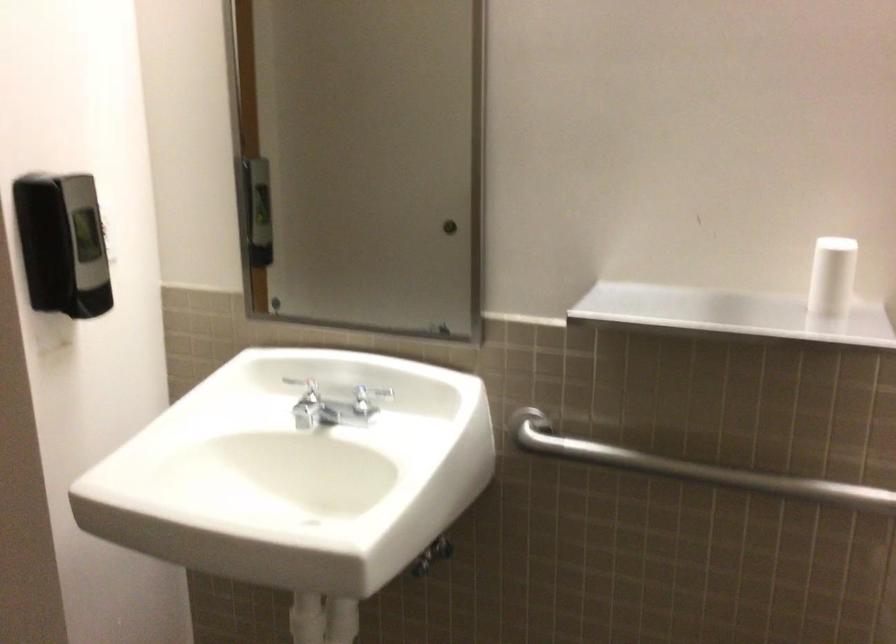
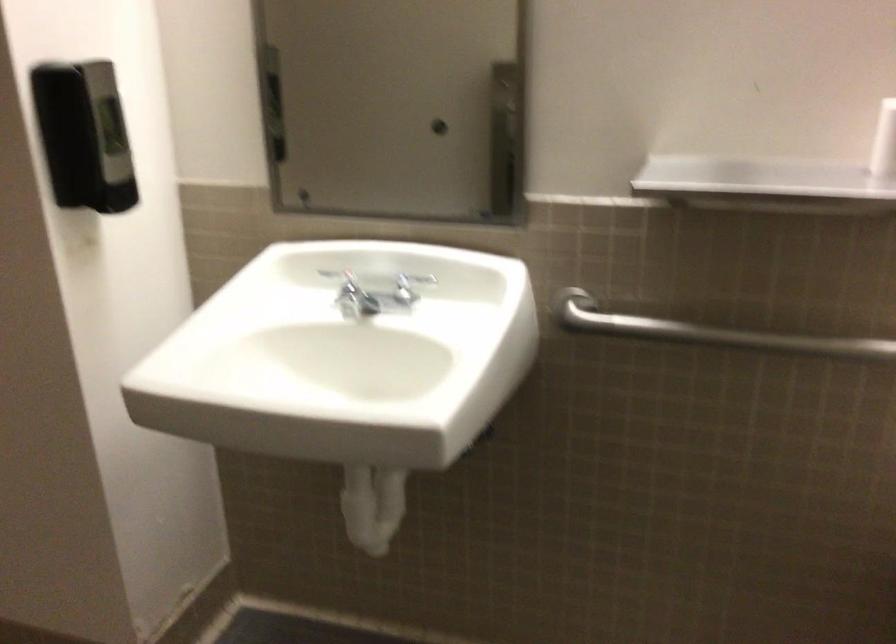
The point at [364,402] is marked in the first image. Where is the corresponding point in the second image?

(403, 290)